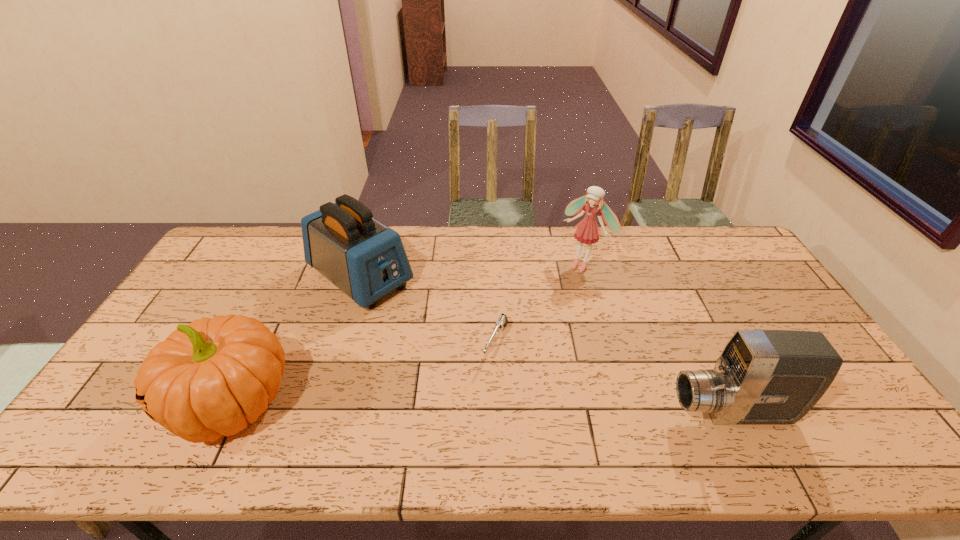
Find the location of a particular element. vacant space situated on the front-facing side of the toaster is located at coordinates (435, 333).

What are the coordinates of `doll that is at the far edge` in the screenshot? It's located at (587, 231).

This screenshot has height=540, width=960. I want to click on toaster that is at the far edge, so pyautogui.click(x=365, y=259).

Where is `pumpkin that is positioned at the near edge`? The width and height of the screenshot is (960, 540). pumpkin that is positioned at the near edge is located at coordinates (212, 377).

In order to click on camcorder located at the near edge in this screenshot , I will do [762, 376].

At what (x,y) coordinates should I click in order to perform the action: click on vacant region at the far edge of the desktop. Please return your answer as a coordinate pair (x, y). The image size is (960, 540). Looking at the image, I should click on (276, 238).

This screenshot has height=540, width=960. What are the coordinates of `vacant space at the left edge` in the screenshot? It's located at (245, 270).

Where is `vacant area that lies between the toaster and the pumpkin`? The height and width of the screenshot is (540, 960). vacant area that lies between the toaster and the pumpkin is located at coordinates (296, 341).

Find the location of a particular element. vacant point located between the toaster and the fourth object from left to right is located at coordinates (471, 271).

Locate an element on the screen. empty space that is in between the camcorder and the toaster is located at coordinates (546, 345).